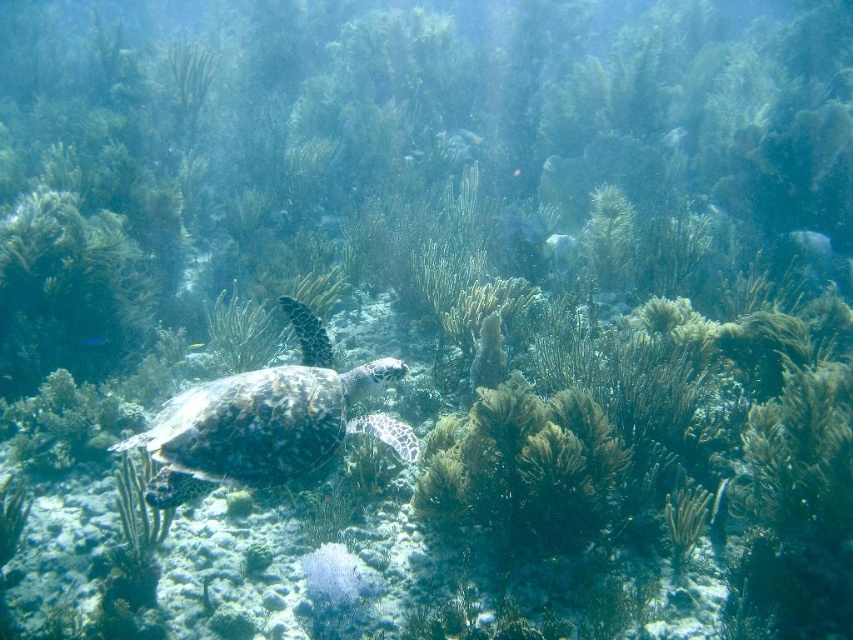
Who is taller, translucent blue fish at upper center or translucent white fish at center?

translucent blue fish at upper center

Identify the location of translucent blue fish at upper center. (674, 136).

From the picture: Is translucent blue fish at upper center to the left of shiny blue fish at center from the viewer's perspective?

In fact, translucent blue fish at upper center is to the right of shiny blue fish at center.

Which is above, translucent blue fish at upper center or shiny blue fish at center?

translucent blue fish at upper center

The width and height of the screenshot is (853, 640). I want to click on translucent blue fish at upper center, so click(x=674, y=136).

Does shiny silver fish at upper center have a larger size compared to shiny blue fish at center?

Indeed, shiny silver fish at upper center has a larger size compared to shiny blue fish at center.

Which of these two, shiny silver fish at upper center or shiny blue fish at center, stands shorter?

shiny blue fish at center

What are the coordinates of `shiny silver fish at upper center` in the screenshot? It's located at (550, 163).